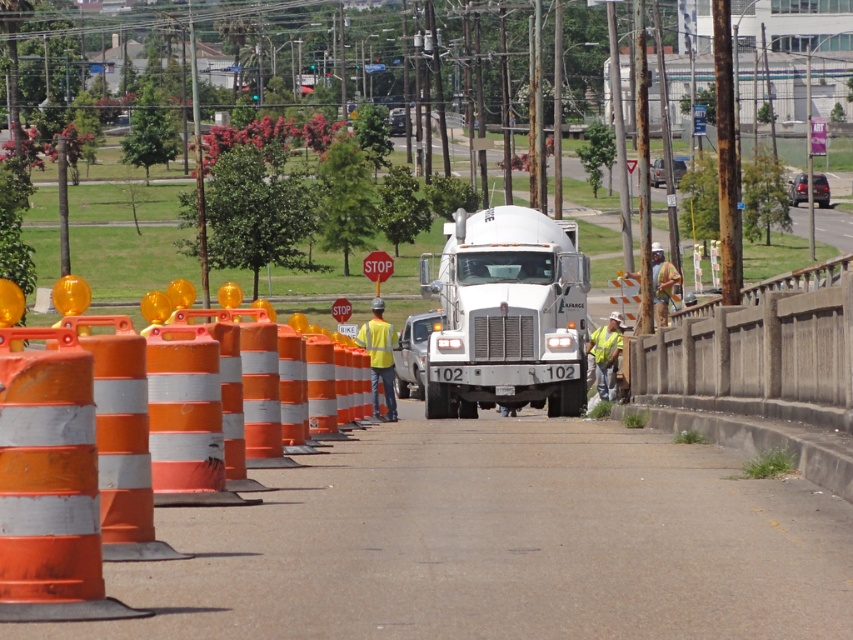
Question: Is yellow reflective safety vest at center to the left of red matte stop sign at center from the viewer's perspective?

Choices:
 (A) no
 (B) yes

Answer: (A)

Question: Observing the image, what is the correct spatial positioning of yellow reflective vest at center in reference to red matte stop sign at center?

Choices:
 (A) above
 (B) below

Answer: (B)

Question: Which of the following is the closest to the observer?

Choices:
 (A) (635, 273)
 (B) (369, 268)
 (C) (604, 376)
 (D) (381, 356)

Answer: (D)

Question: Which point appears closest to the camera in this image?

Choices:
 (A) (601, 384)
 (B) (367, 328)

Answer: (B)

Question: Does yellow reflective safety vest at lower right come behind red matte stop sign at center?

Choices:
 (A) no
 (B) yes

Answer: (A)

Question: Which of the following is the farthest from the observer?

Choices:
 (A) 606,376
 (B) 755,401
 (C) 614,340
 (D) 373,278

Answer: (D)